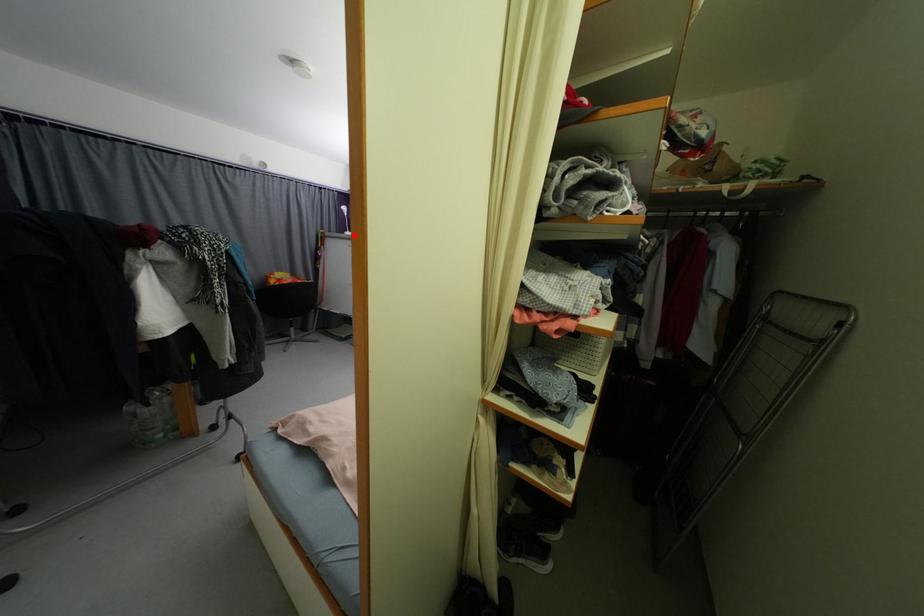
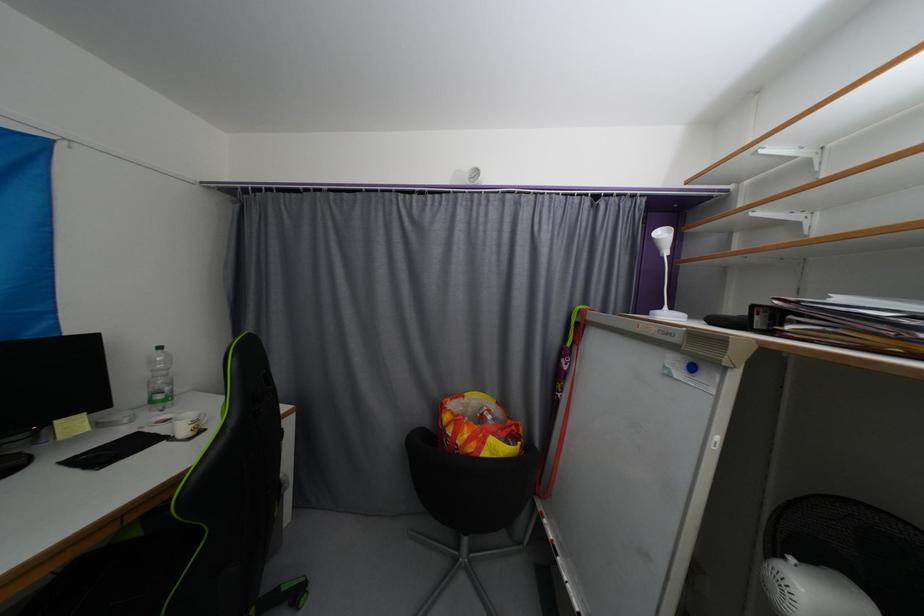
The point at the highlighted location is marked in the first image. Where is the corresponding point in the second image?

(672, 317)